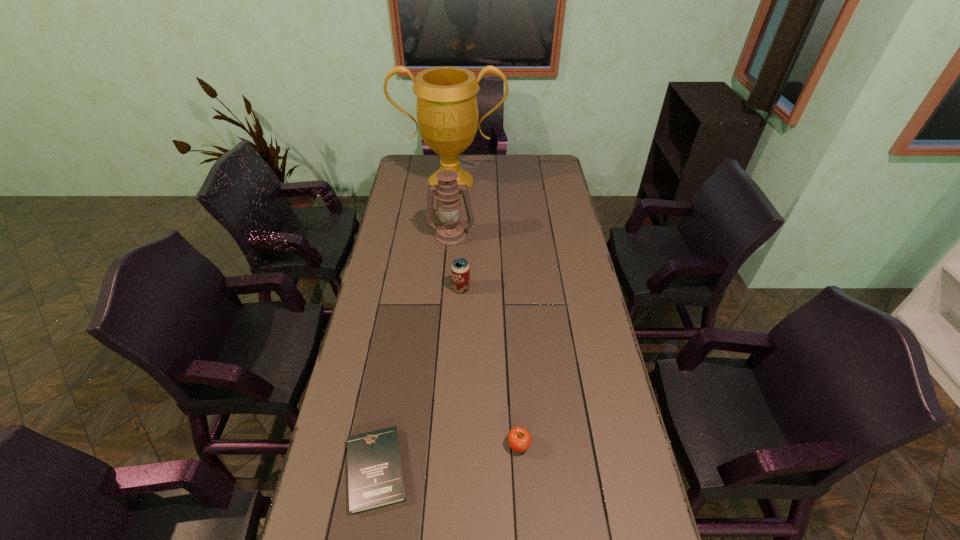
The height and width of the screenshot is (540, 960). Identify the location of free space that satisfies the following two spatial constraints: 1. on the back side of the third nearest object; 2. on the left side of the shortest object. (407, 288).

Identify the location of blank area in the image that satisfies the following two spatial constraints: 1. on the front side of the apple; 2. on the left side of the fourth shortest object. This screenshot has height=540, width=960. (435, 445).

Locate an element on the screen. The height and width of the screenshot is (540, 960). free space that satisfies the following two spatial constraints: 1. on the front side of the apple; 2. on the right side of the beer can is located at coordinates (454, 445).

This screenshot has height=540, width=960. Identify the location of vacant space that satisfies the following two spatial constraints: 1. on the engravings side of the trophy; 2. on the right side of the second tallest object. (446, 235).

You are a GUI agent. You are given a task and a screenshot of the screen. Output one action in this format:
    pyautogui.click(x=<x>, y=<y>)
    Task: Click on the vacant space that satisfies the following two spatial constraints: 1. on the engravings side of the farthest object; 2. on the right side of the third farthest object
    
    Given the screenshot: What is the action you would take?
    pyautogui.click(x=442, y=288)